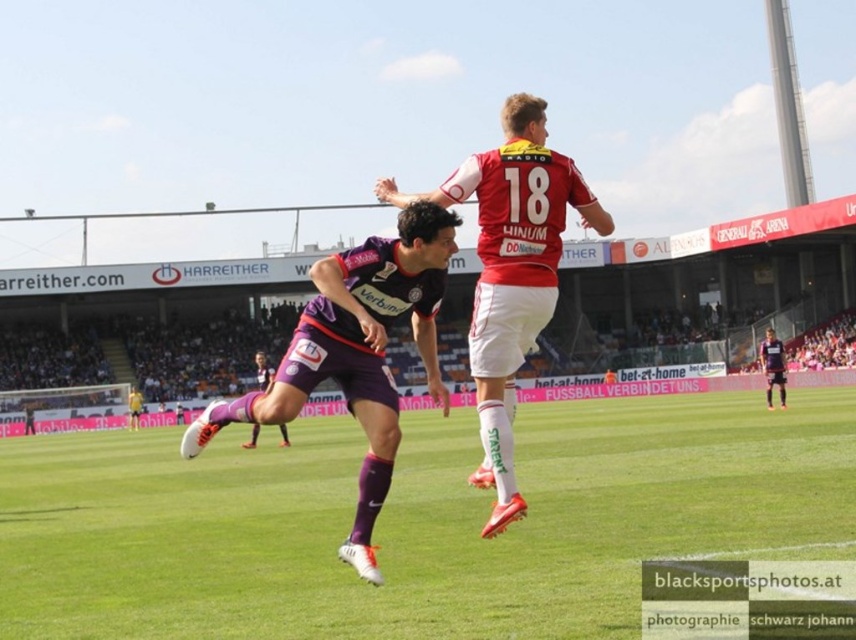
Question: Is green grass at center positioned before purple matte shorts at lower center?

Choices:
 (A) yes
 (B) no

Answer: (A)

Question: Which is farther from the dark purple jersey at center?

Choices:
 (A) purple matte jersey at center
 (B) red jersey at center
 (C) green grass at center
 (D) purple matte shorts at lower center

Answer: (A)

Question: Is purple matte jersey at center further to camera compared to red jersey at center?

Choices:
 (A) no
 (B) yes

Answer: (A)

Question: Is green grass at center closer to camera compared to purple matte shorts at lower center?

Choices:
 (A) no
 (B) yes

Answer: (B)

Question: Which of the following is the farthest from the observer?

Choices:
 (A) (438, 452)
 (B) (265, 358)

Answer: (B)

Question: Considering the real-world distances, which object is farthest from the green grass at center?

Choices:
 (A) purple matte shorts at lower center
 (B) purple matte jersey at center
 (C) red jersey at center

Answer: (B)